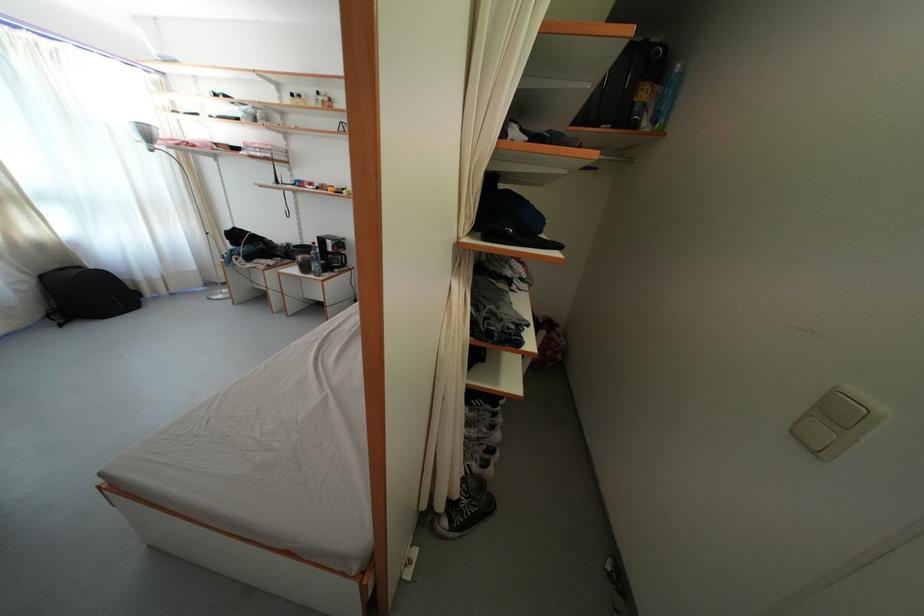
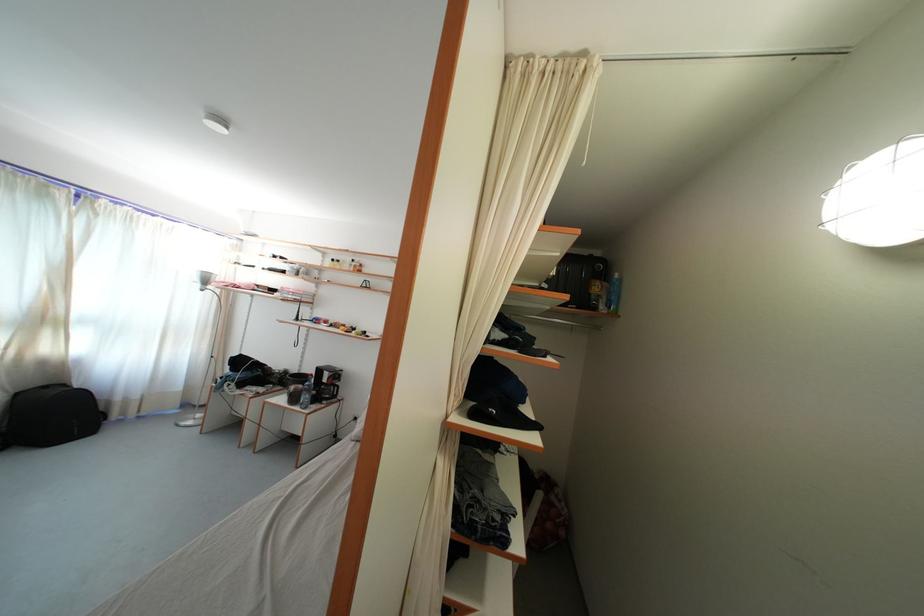
Where in the second image is the point corresponding to (49,283) from the first image?

(23, 400)